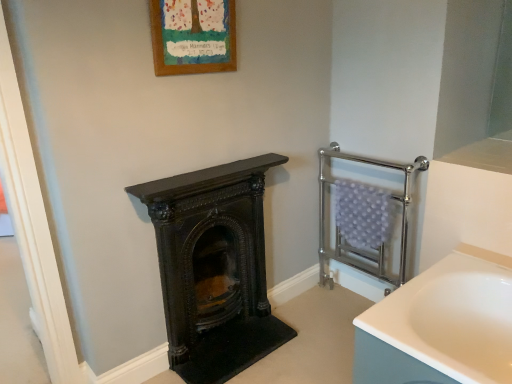
Question: Can you see black polished wood burning stove at center touching chrome metallic towel rack at right?

Choices:
 (A) yes
 (B) no

Answer: (B)

Question: Is black polished wood burning stove at center taller than chrome metallic towel rack at right?

Choices:
 (A) no
 (B) yes

Answer: (A)

Question: Is black polished wood burning stove at center aimed at chrome metallic towel rack at right?

Choices:
 (A) yes
 (B) no

Answer: (B)

Question: Does black polished wood burning stove at center have a greater width compared to chrome metallic towel rack at right?

Choices:
 (A) no
 (B) yes

Answer: (A)

Question: Can you confirm if black polished wood burning stove at center is thinner than chrome metallic towel rack at right?

Choices:
 (A) yes
 (B) no

Answer: (A)

Question: In terms of height, does black polished wood burning stove at center look taller or shorter compared to wooden frame at upper center?

Choices:
 (A) short
 (B) tall

Answer: (B)

Question: Considering the positions of black polished wood burning stove at center and wooden frame at upper center in the image, is black polished wood burning stove at center wider or thinner than wooden frame at upper center?

Choices:
 (A) wide
 (B) thin

Answer: (A)

Question: Based on their sizes in the image, would you say black polished wood burning stove at center is bigger or smaller than wooden frame at upper center?

Choices:
 (A) small
 (B) big

Answer: (B)

Question: Relative to wooden frame at upper center, is black polished wood burning stove at center in front or behind?

Choices:
 (A) front
 (B) behind

Answer: (B)

Question: In terms of size, does wooden frame at upper center appear bigger or smaller than black polished wood burning stove at center?

Choices:
 (A) small
 (B) big

Answer: (A)

Question: From a real-world perspective, is wooden frame at upper center above or below black polished wood burning stove at center?

Choices:
 (A) above
 (B) below

Answer: (A)

Question: From the image's perspective, is wooden frame at upper center located above or below black polished wood burning stove at center?

Choices:
 (A) below
 (B) above

Answer: (B)

Question: Is wooden frame at upper center in front of or behind black polished wood burning stove at center in the image?

Choices:
 (A) front
 (B) behind

Answer: (A)

Question: Considering the positions of chrome metallic towel rack at right and wooden frame at upper center in the image, is chrome metallic towel rack at right taller or shorter than wooden frame at upper center?

Choices:
 (A) short
 (B) tall

Answer: (B)

Question: Is point (320, 246) closer or farther from the camera than point (192, 66)?

Choices:
 (A) farther
 (B) closer

Answer: (A)